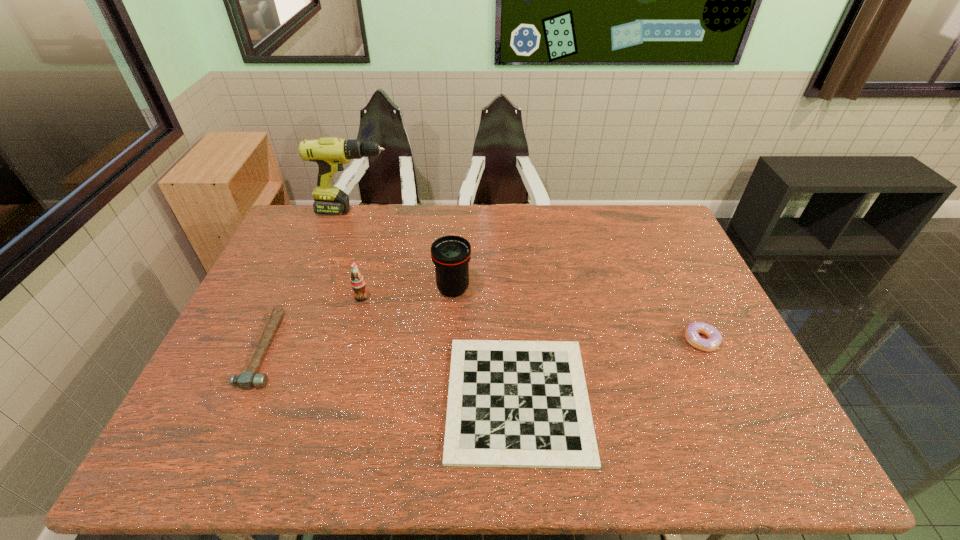
Locate an element on the screen. The image size is (960, 540). vacant space at the far edge of the desktop is located at coordinates (415, 216).

Identify the location of vacant region at the left edge of the desktop. tap(191, 421).

In the image, there is a desktop. Where is `vacant space at the right edge`? The height and width of the screenshot is (540, 960). vacant space at the right edge is located at coordinates (686, 370).

In the image, there is a desktop. At what (x,y) coordinates should I click in order to perform the action: click on vacant space at the far left corner. Please return your answer as a coordinate pair (x, y). Looking at the image, I should click on (292, 226).

Where is `blank space at the near left corner of the desktop`? The image size is (960, 540). blank space at the near left corner of the desktop is located at coordinates (210, 451).

At what (x,y) coordinates should I click in order to perform the action: click on free spot between the hammer and the checkerboard. Please return your answer as a coordinate pair (x, y). Looking at the image, I should click on (392, 374).

You are a GUI agent. You are given a task and a screenshot of the screen. Output one action in this format:
    pyautogui.click(x=<x>, y=<y>)
    Task: Click on the vacant region between the second shortest object and the soda
    The image size is (960, 540).
    Given the screenshot: What is the action you would take?
    pyautogui.click(x=314, y=323)

I want to click on free space between the soda and the farthest object, so click(x=358, y=254).

You are a GUI agent. You are given a task and a screenshot of the screen. Output one action in this format:
    pyautogui.click(x=<x>, y=<y>)
    Task: Click on the vacant space that is in between the soda and the fifth tallest object
    
    Given the screenshot: What is the action you would take?
    pyautogui.click(x=314, y=323)

This screenshot has height=540, width=960. I want to click on vacant space in between the fourth tallest object and the fourth shortest object, so tap(532, 319).